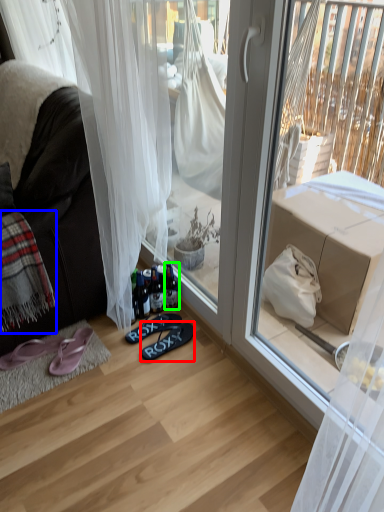
Question: Which is farther away from footwear (highlighted by a red box)? blanket (highlighted by a blue box) or bottle (highlighted by a green box)?

Choices:
 (A) blanket
 (B) bottle

Answer: (A)